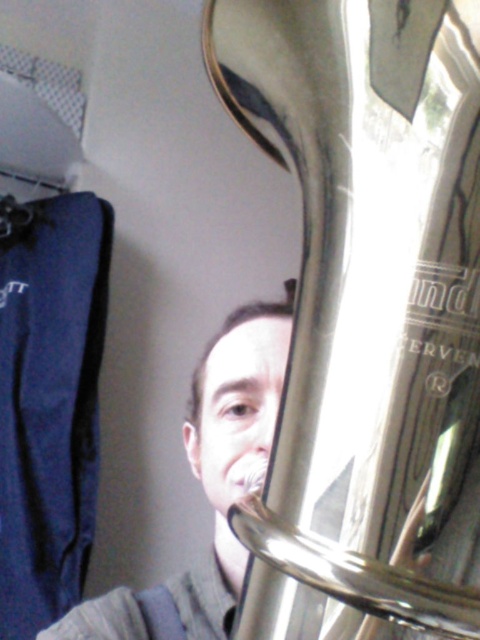
Does polished silver trumpet at center have a smaller size compared to matte silver tuba at center?

Yes, polished silver trumpet at center is smaller than matte silver tuba at center.

Can you confirm if polished silver trumpet at center is positioned to the right of matte silver tuba at center?

Correct, you'll find polished silver trumpet at center to the right of matte silver tuba at center.

Locate an element on the screen. The height and width of the screenshot is (640, 480). polished silver trumpet at center is located at coordinates (363, 314).